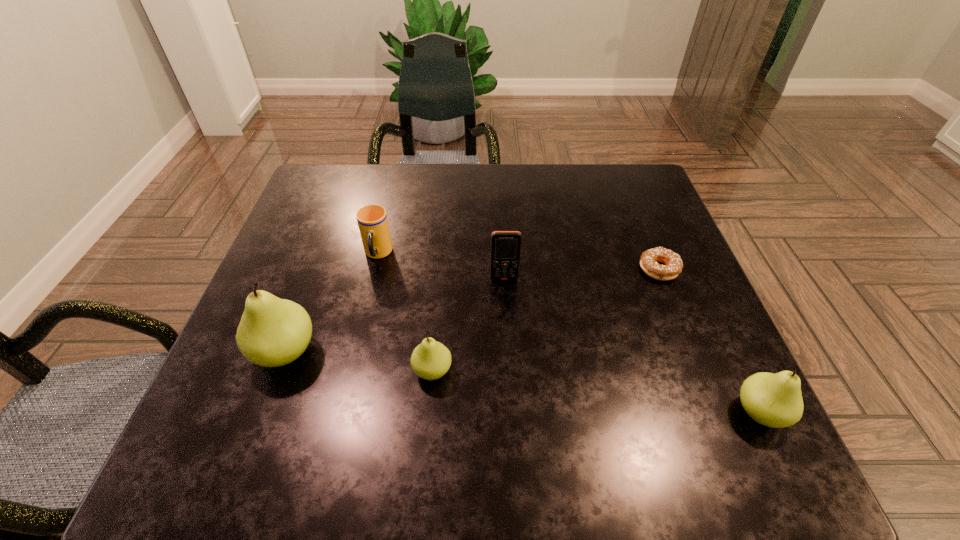
What are the coordinates of `vacant space located 0.360m on the left of the rightmost pear` in the screenshot? It's located at (526, 412).

Where is `vacant space located 0.220m on the screen of the cellular telephone`? Image resolution: width=960 pixels, height=540 pixels. vacant space located 0.220m on the screen of the cellular telephone is located at coordinates click(509, 367).

You are a GUI agent. You are given a task and a screenshot of the screen. Output one action in this format:
    pyautogui.click(x=<x>, y=<y>)
    Task: Click on the vacant position located 0.280m on the side of the cup with the handle
    This screenshot has width=960, height=540.
    Given the screenshot: What is the action you would take?
    pyautogui.click(x=349, y=374)

Identify the location of vacant space located 0.230m on the left of the shortest object. (540, 269).

The height and width of the screenshot is (540, 960). I want to click on object at the left edge, so click(x=273, y=332).

Where is `pear that is at the right edge`? pear that is at the right edge is located at coordinates (775, 400).

Locate an element on the screen. This screenshot has height=540, width=960. doughnut located at the right edge is located at coordinates (673, 266).

Find the location of `object present at the near left corner`. object present at the near left corner is located at coordinates (273, 332).

The width and height of the screenshot is (960, 540). Find the location of `object present at the near right corner`. object present at the near right corner is located at coordinates (775, 400).

In the image, there is a desktop. Where is `vacant space at the far edge`? This screenshot has height=540, width=960. vacant space at the far edge is located at coordinates (522, 168).